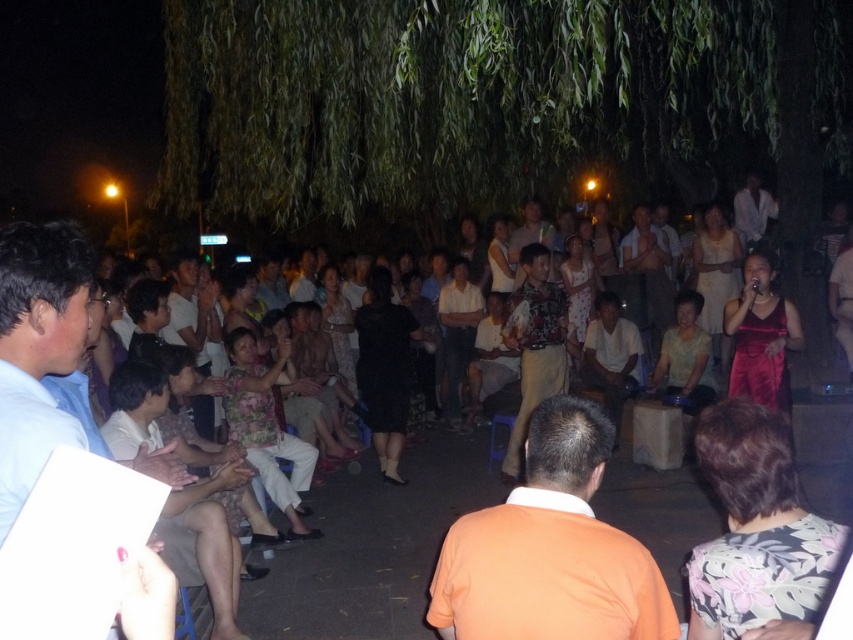
You are at a nighttime gathering under a tree and see the floral dress at center and the light brown wood chair at lower left. Which object takes up more space in the image?

The floral dress at center is larger in size than the light brown wood chair at lower left, so it takes up more space in the image.

You are standing at the point with coordinates [550,548] in the image. What is the closest object to you?

The closest object to you at point [550,548] is the orange cotton shirt at center.

You are at a nighttime gathering under a tree and see two people in the crowd. One is wearing a floral dress at center and the other is wearing a light blue shirt at left. Which person is wearing a larger outfit?

The floral dress at center is bigger than the light blue shirt at left, so the person wearing the floral dress at center has a larger outfit.